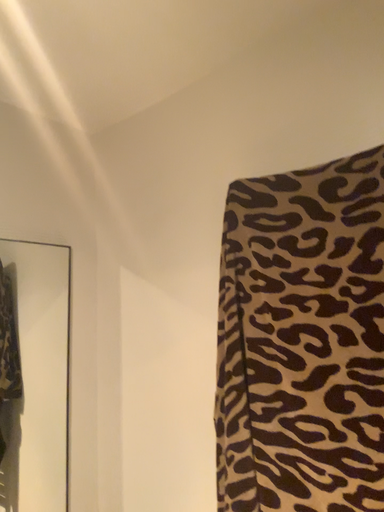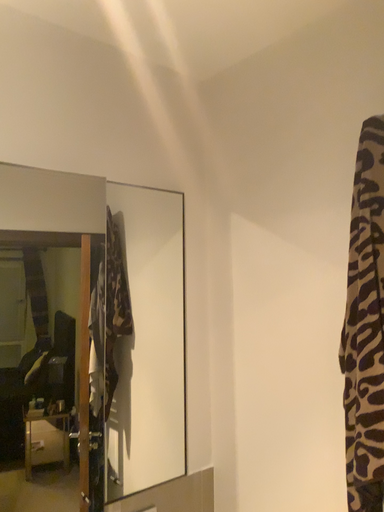
Question: Which way did the camera rotate in the video?

Choices:
 (A) rotated left
 (B) rotated right

Answer: (A)